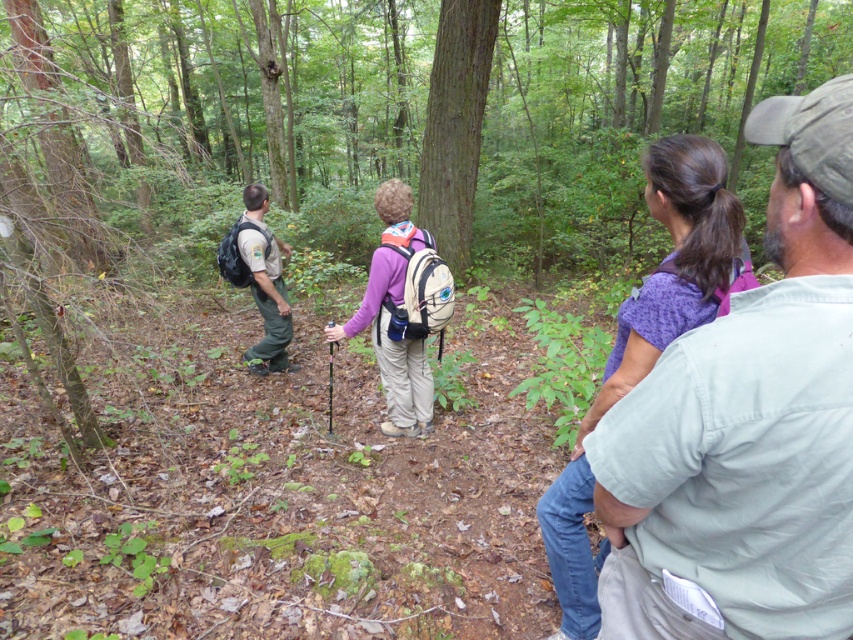
You are a photographer trying to capture a photo of the gray cotton shirt at upper right and the green uniform at left. Which of the two should you focus on first if you want to ensure both are in sharp focus?

You should focus on the gray cotton shirt at upper right first because it is closer to the viewer than the green uniform at left, so adjusting focus from near to far will help both be in sharp focus.

You are a photographer planning to take a group photo of the hikers. You need to arrange them so that the gray cotton shirt at upper right and the green uniform at left are both visible. Considering their heights, which hiker should you place in the front row?

The gray cotton shirt at upper right is shorter than the green uniform at left, so you should place the gray cotton shirt at upper right in the front row to ensure both are visible.

You are a photographer trying to capture a candid shot of the gray cotton shirt at upper right without being noticed. The camera you are using has a focal length that requires a minimum distance of 35 inches to avoid distortion. Can you position yourself at the camera to take the shot without distortion?

The gray cotton shirt at upper right and camera are 36.17 inches apart, which is greater than the minimum required distance of 35 inches. Therefore, you can position yourself at the camera to take the shot without distortion.